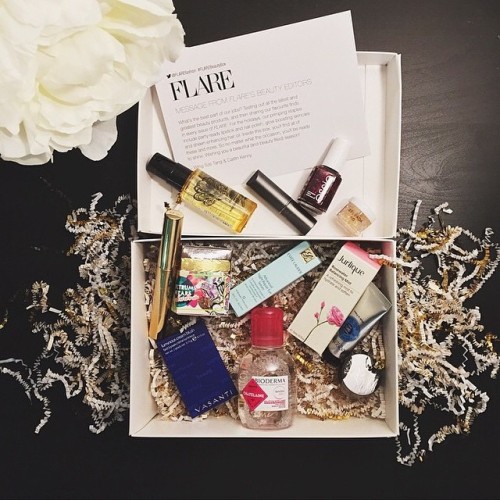
Identify the location of black table. The image size is (500, 500). (442, 154).